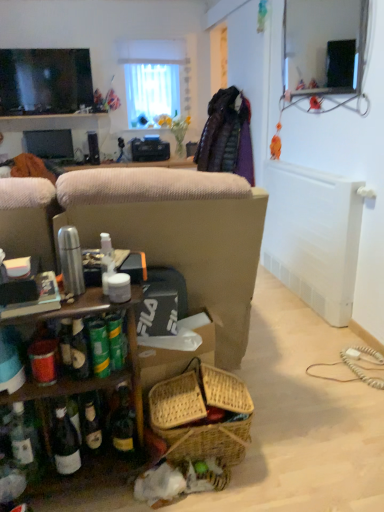
Question: Considering the relative sizes of matte black monitor at left, which appears as the first television when viewed from the back, and white sheer curtain at upper center in the image provided, is matte black monitor at left, which appears as the first television when viewed from the back, smaller than white sheer curtain at upper center?

Choices:
 (A) yes
 (B) no

Answer: (A)

Question: Can white sheer curtain at upper center be found inside matte black monitor at left, which appears as the first television when ordered from the bottom?

Choices:
 (A) no
 (B) yes

Answer: (A)

Question: From a real-world perspective, does matte black monitor at left, acting as the 2th television starting from the top, stand above white sheer curtain at upper center?

Choices:
 (A) yes
 (B) no

Answer: (B)

Question: Is matte black monitor at left, the 2th television from the front, positioned far away from white sheer curtain at upper center?

Choices:
 (A) no
 (B) yes

Answer: (B)

Question: Considering the relative sizes of matte black monitor at left, which appears as the first television when ordered from the bottom, and white sheer curtain at upper center in the image provided, is matte black monitor at left, which appears as the first television when ordered from the bottom, taller than white sheer curtain at upper center?

Choices:
 (A) no
 (B) yes

Answer: (A)

Question: From a real-world perspective, is matte black monitor at left, acting as the 2th television starting from the top, below white sheer curtain at upper center?

Choices:
 (A) no
 (B) yes

Answer: (B)

Question: From a real-world perspective, is white sheer curtain at upper center located beneath matte black tv at upper left, placed as the second television when sorted from bottom to top?

Choices:
 (A) no
 (B) yes

Answer: (A)

Question: Is white sheer curtain at upper center far away from matte black tv at upper left, placed as the second television when sorted from bottom to top?

Choices:
 (A) yes
 (B) no

Answer: (B)

Question: Considering the relative sizes of white sheer curtain at upper center and matte black tv at upper left, the first television viewed from the top, in the image provided, is white sheer curtain at upper center thinner than matte black tv at upper left, the first television viewed from the top,?

Choices:
 (A) yes
 (B) no

Answer: (B)

Question: Is white sheer curtain at upper center touching matte black tv at upper left, placed as the second television when sorted from bottom to top?

Choices:
 (A) no
 (B) yes

Answer: (A)

Question: Is white sheer curtain at upper center looking in the opposite direction of matte black tv at upper left, the second television viewed from the back?

Choices:
 (A) no
 (B) yes

Answer: (A)

Question: Is matte black tv at upper left, placed as the second television when sorted from bottom to top, surrounded by white sheer curtain at upper center?

Choices:
 (A) no
 (B) yes

Answer: (A)

Question: From a real-world perspective, is white sheer curtain at upper center physically below matte black monitor at left, which appears as the first television when ordered from the bottom?

Choices:
 (A) no
 (B) yes

Answer: (A)